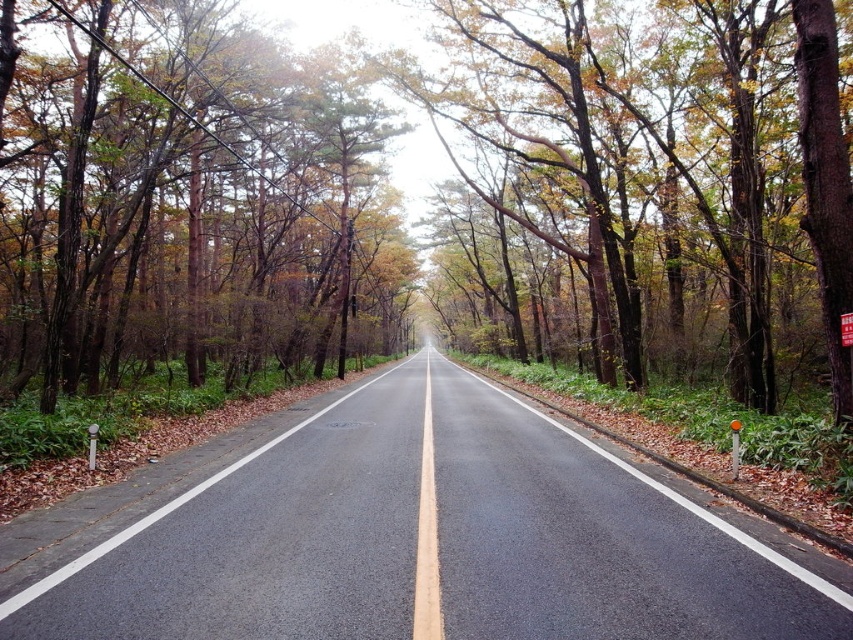
You are driving a car and see the brown wood tree at center and the black asphalt road at center ahead. Which object is positioned to the right side of the other?

The brown wood tree at center is to the right of the black asphalt road at center.

You are driving a car that is 2 meters wide. You come across a section of road where the black asphalt road at center is flanked by a brown wood tree at center. Will your car fit through the road without hitting the tree?

The brown wood tree at center might be wider than the black asphalt road at center, so there is a possibility that the car could hit the tree if it is wider than the road. It is safer to proceed with caution or find an alternative route.

You are driving a car and see the brown wood tree at center and the brown wood tree at left from the driver seat. Which tree is closer to the left side of the road?

The brown wood tree at left is closer to the left side of the road because it is positioned to the left of the brown wood tree at center.